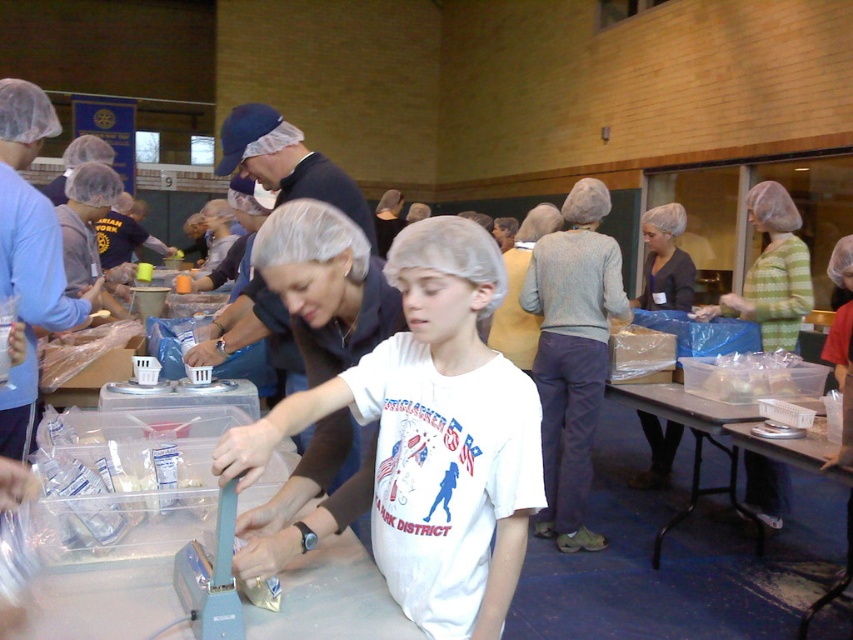
Question: Which of the following is the closest to the observer?

Choices:
 (A) translucent plastic container at lower right
 (B) matte black shirt at center
 (C) metallic silver table at lower right

Answer: (A)

Question: Is white cotton shirt at center below translucent plastic container at lower right?

Choices:
 (A) yes
 (B) no

Answer: (B)

Question: Does white cotton shirt at center lie in front of metallic silver table at lower right?

Choices:
 (A) yes
 (B) no

Answer: (A)

Question: Which of the following is the farthest from the observer?

Choices:
 (A) (717, 396)
 (B) (398, 371)
 (C) (650, 230)
 (D) (723, 426)

Answer: (C)

Question: Can you confirm if green striped shirt at center is positioned to the left of matte black shirt at center?

Choices:
 (A) no
 (B) yes

Answer: (A)

Question: Among these points, which one is nearest to the camera?

Choices:
 (A) (780, 301)
 (B) (788, 371)
 (C) (668, 272)
 (D) (700, 403)

Answer: (D)